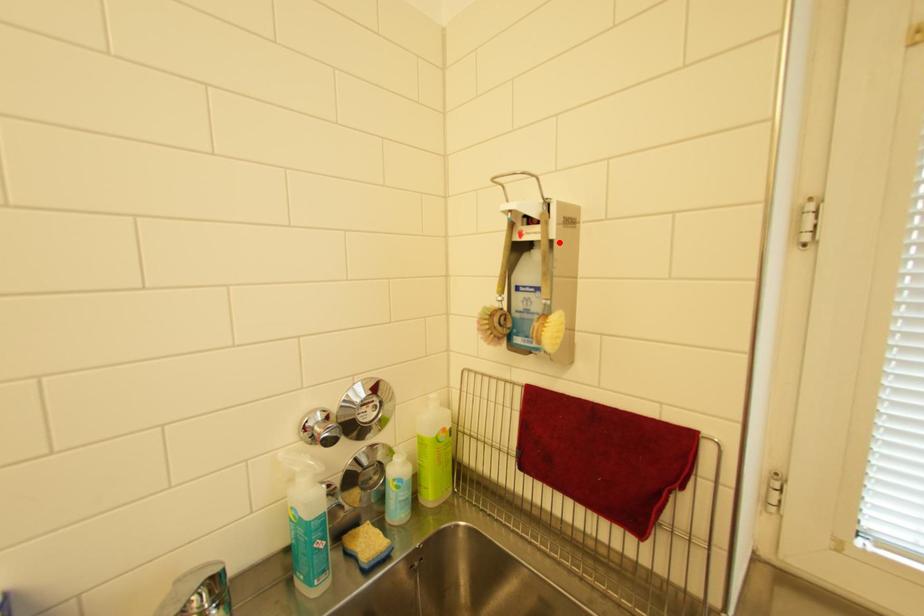
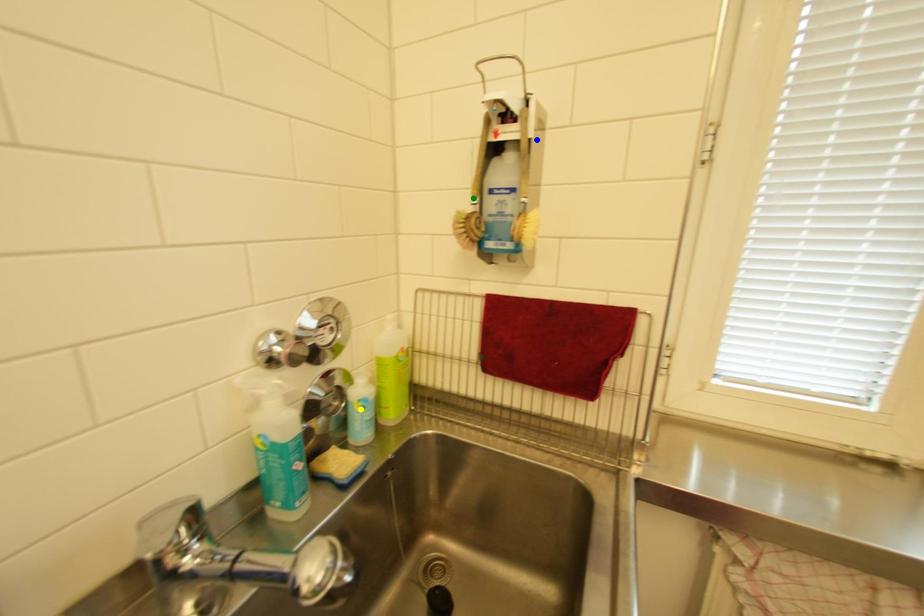
Question: I am providing you with two images of the same scene from different viewpoints. A red point is marked on the first image. You are given multiple points on the second image. Can you choose the point in image 2 that corresponds to the point in image 1?

Choices:
 (A) yellow point
 (B) blue point
 (C) green point

Answer: (B)